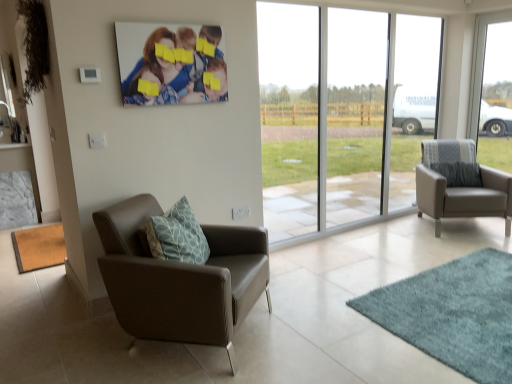
At what (x,y) coordinates should I click in order to perform the action: click on free space that is to the left of matte gray armchair at right, positioned as the 2th chair in left-to-right order. Please return your answer as a coordinate pair (x, y). Looking at the image, I should click on (390, 230).